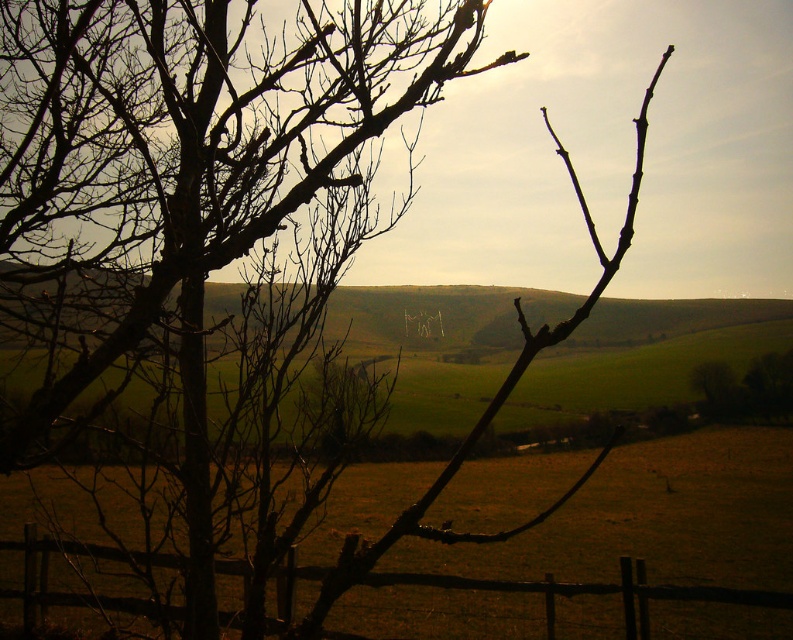
Question: From the image, what is the correct spatial relationship of brown rough branches at left in relation to brown wooden fence at lower center?

Choices:
 (A) below
 (B) above

Answer: (B)

Question: Is brown rough branches at left wider than brown wooden fence at lower center?

Choices:
 (A) yes
 (B) no

Answer: (B)

Question: Which of the following is the closest to the observer?

Choices:
 (A) (136, 563)
 (B) (102, 280)

Answer: (A)

Question: Among these points, which one is farthest from the camera?

Choices:
 (A) (8, 545)
 (B) (2, 305)

Answer: (A)

Question: Does brown rough branches at left have a larger size compared to brown wooden fence at lower center?

Choices:
 (A) yes
 (B) no

Answer: (B)